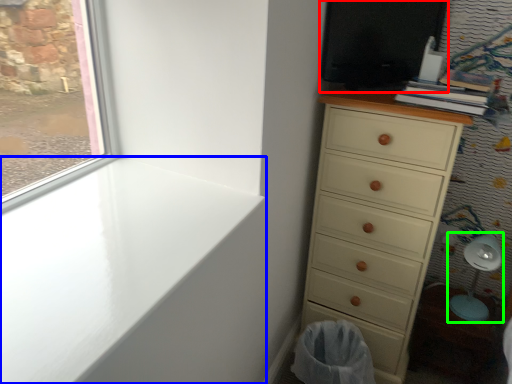
Question: Based on their relative distances, which object is nearer to screen door (highlighted by a red box)? Choose from window sill (highlighted by a blue box) and swivel chair (highlighted by a green box).

Choices:
 (A) window sill
 (B) swivel chair

Answer: (A)